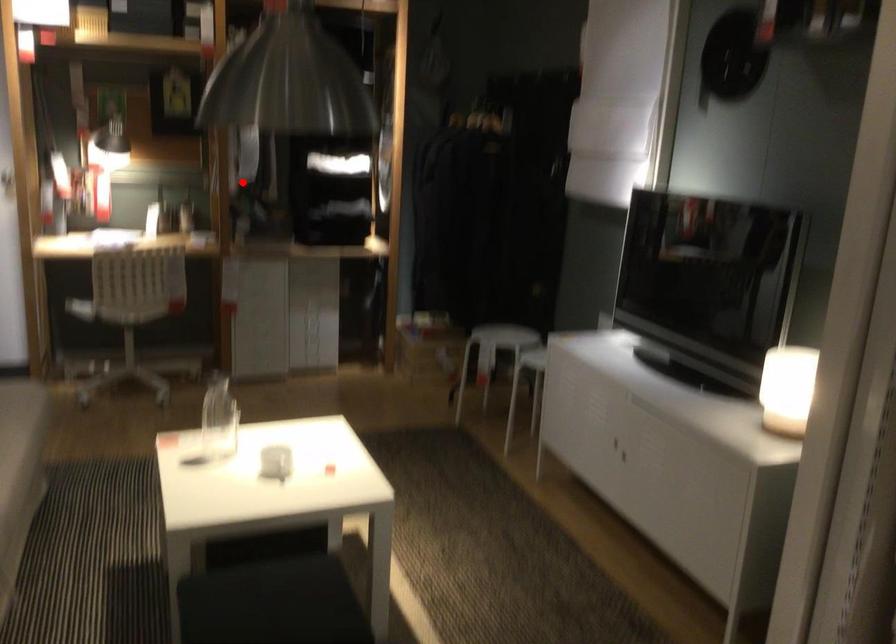
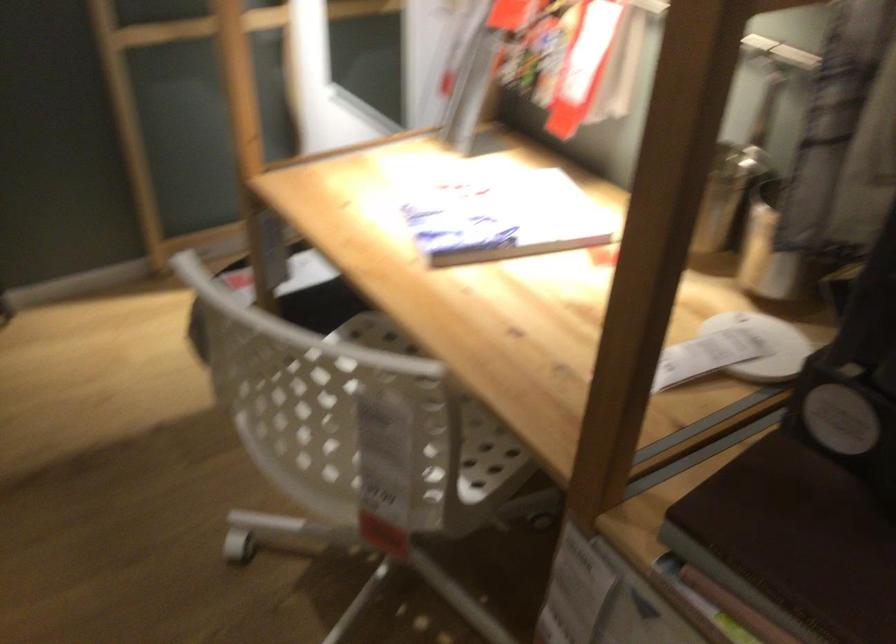
Find the pixel in the second image that matches the highlighted location in the first image.

(771, 252)